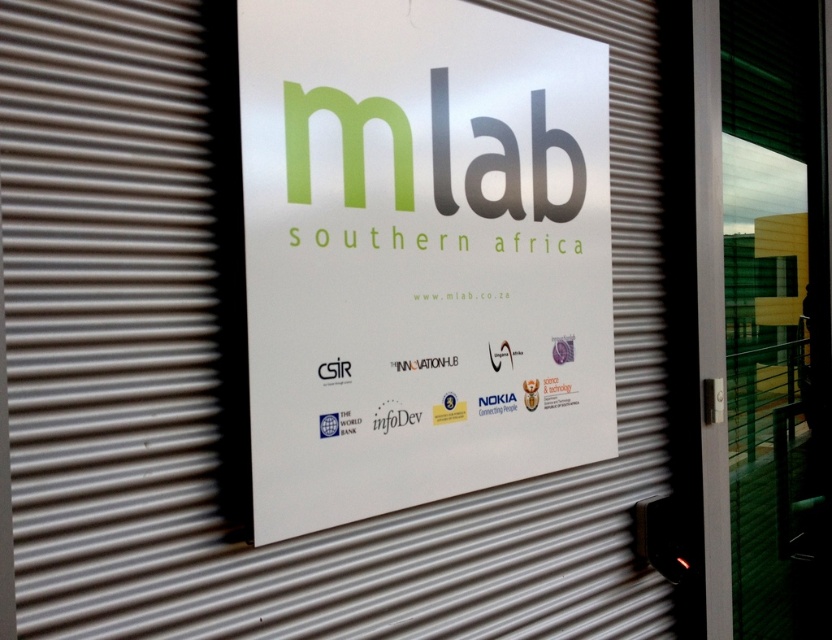
Question: In this image, where is white paper sign at center located relative to transparent glass screen door at right?

Choices:
 (A) left
 (B) right

Answer: (A)

Question: Among these points, which one is nearest to the camera?

Choices:
 (A) (776, 563)
 (B) (562, 188)

Answer: (B)

Question: Does white paper sign at center have a larger size compared to transparent glass screen door at right?

Choices:
 (A) yes
 (B) no

Answer: (B)

Question: Which of the following is the closest to the observer?

Choices:
 (A) transparent glass screen door at right
 (B) white paper sign at center

Answer: (B)

Question: Is the position of white paper sign at center more distant than that of transparent glass screen door at right?

Choices:
 (A) no
 (B) yes

Answer: (A)